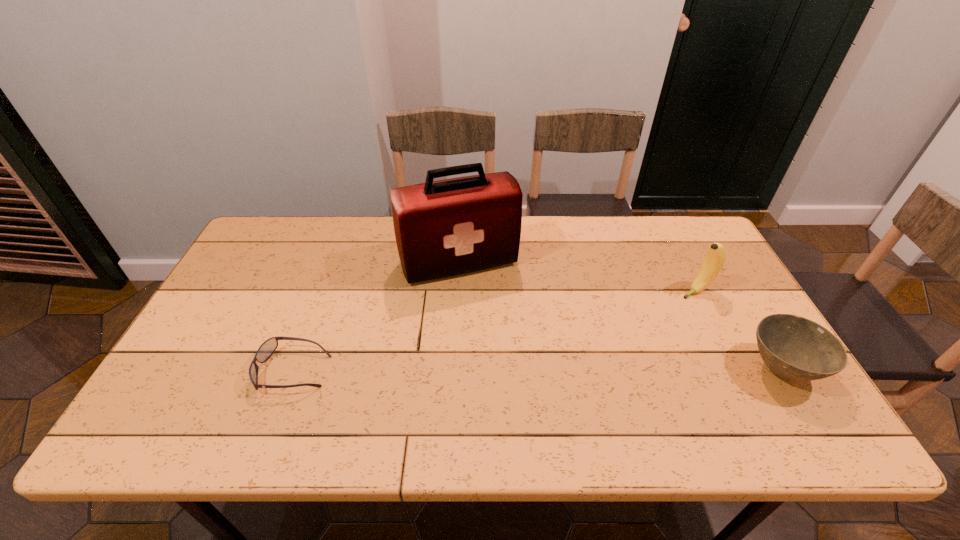
The image size is (960, 540). In order to click on the leftmost object in this screenshot , I will do `click(267, 348)`.

Find the location of a particular element. This screenshot has height=540, width=960. sunglasses is located at coordinates (267, 348).

Locate an element on the screen. This screenshot has height=540, width=960. bowl is located at coordinates (795, 348).

Image resolution: width=960 pixels, height=540 pixels. I want to click on the tallest object, so click(449, 227).

This screenshot has height=540, width=960. What are the coordinates of `the second object from left to right` in the screenshot? It's located at (449, 227).

Locate an element on the screen. The height and width of the screenshot is (540, 960). the third shortest object is located at coordinates (716, 256).

Locate an element on the screen. vacant space located 0.120m on the lenses of the leftmost object is located at coordinates (210, 370).

Find the location of `free space located 0.100m on the lenses of the leftmost object`. free space located 0.100m on the lenses of the leftmost object is located at coordinates (218, 370).

I want to click on free location located on the lenses of the leftmost object, so click(194, 370).

Find the location of a particular element. The image size is (960, 540). vacant area located on the left of the second shortest object is located at coordinates (650, 370).